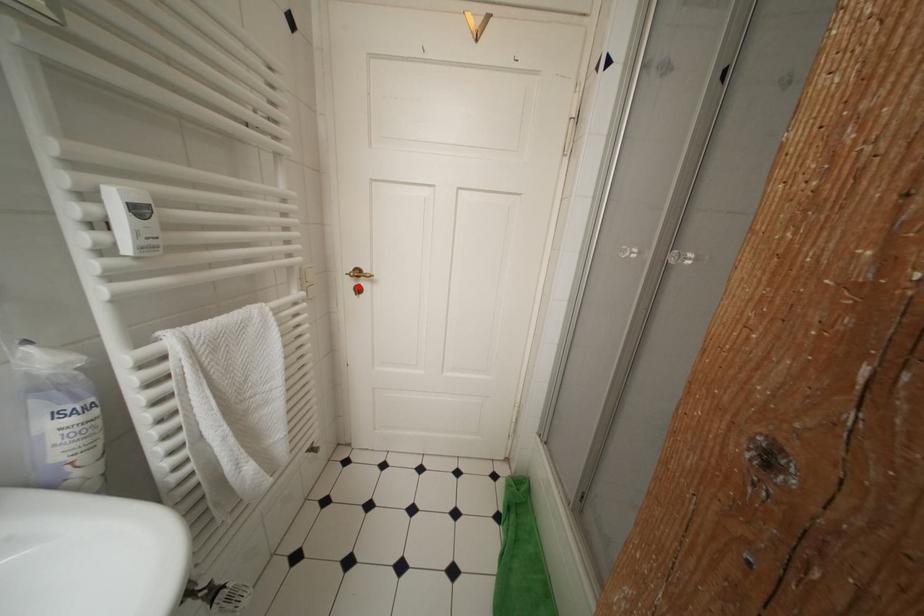
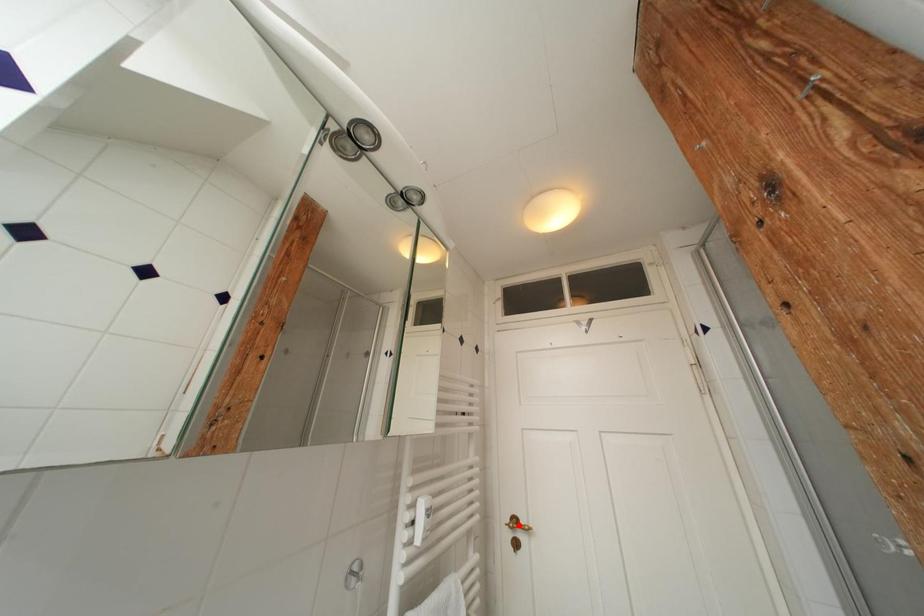
I am providing you with two images of the same scene from different viewpoints. A red point is marked on the first image and another point is marked on the second image. Does the point marked in image1 correspond to the same location as the one in image2?

No